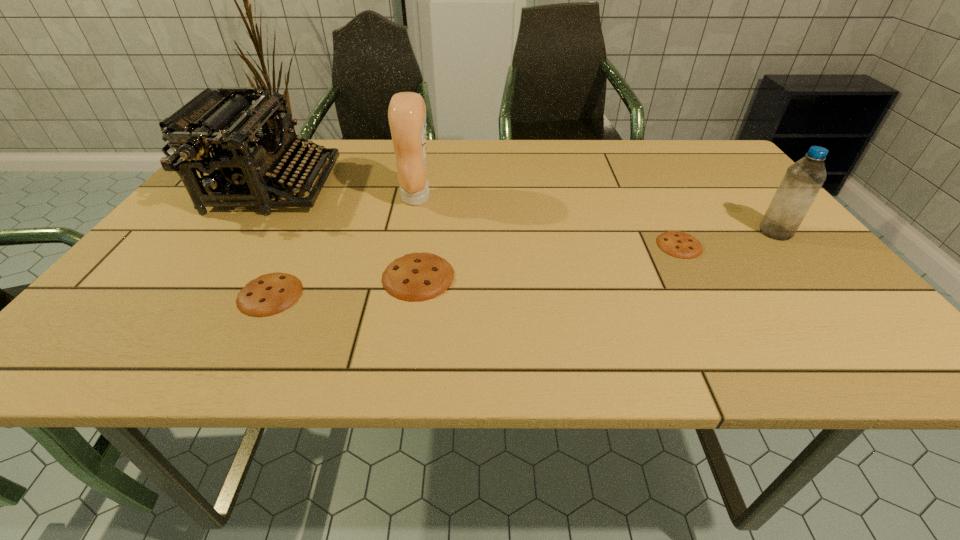
Find the location of `vacant space at the near edge of the desktop`. vacant space at the near edge of the desktop is located at coordinates (674, 295).

What are the coordinates of `vacant space at the right edge of the desktop` in the screenshot? It's located at (796, 285).

This screenshot has height=540, width=960. I want to click on free space at the far right corner, so click(x=693, y=139).

Find the location of a particular element. free spot between the leftmost cookie and the second cookie from left to right is located at coordinates (345, 285).

In order to click on free spot between the second tallest cookie and the water bottle in this screenshot , I will do `click(523, 263)`.

Identify the location of empty space between the rightmost object and the second shortest object. (523, 263).

The width and height of the screenshot is (960, 540). Find the location of `vacant area between the tallest cookie and the water bottle`. vacant area between the tallest cookie and the water bottle is located at coordinates (597, 254).

The image size is (960, 540). I want to click on unoccupied area between the leftmost cookie and the typewriter, so click(x=272, y=240).

Where is `vacant space that is in between the fourth tallest object and the second object from right to left`? vacant space that is in between the fourth tallest object and the second object from right to left is located at coordinates (549, 261).

Locate an element on the screen. The width and height of the screenshot is (960, 540). free space between the fourth tallest object and the condiment is located at coordinates tap(418, 237).